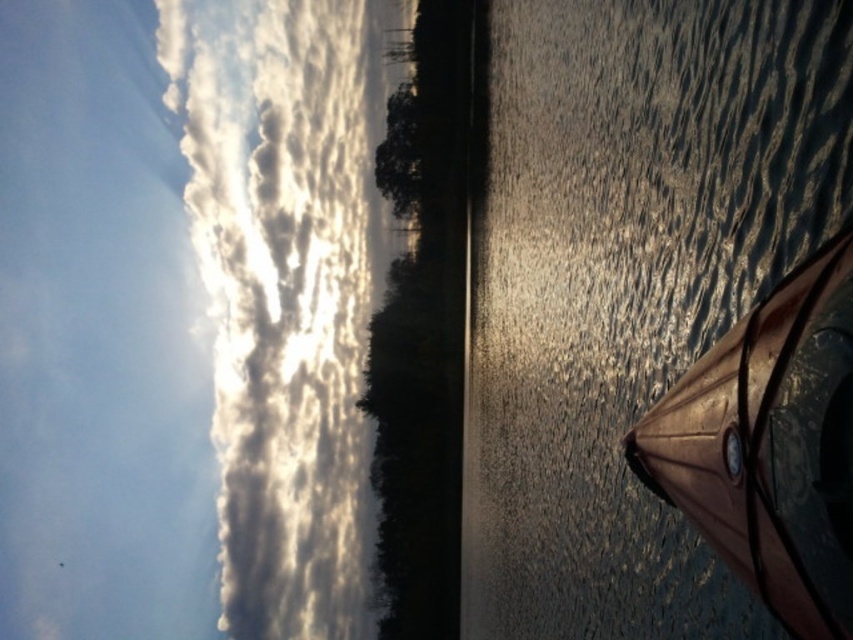
Question: Which point is farther to the camera?

Choices:
 (A) glistening water at lower right
 (B) cloudy sky at upper left

Answer: (B)

Question: Can you confirm if glistening water at lower right is bigger than cloudy sky at upper left?

Choices:
 (A) yes
 (B) no

Answer: (B)

Question: Among these objects, which one is nearest to the camera?

Choices:
 (A) cloudy sky at upper left
 (B) glistening water at lower right

Answer: (B)

Question: Can you confirm if glistening water at lower right is bigger than cloudy sky at upper left?

Choices:
 (A) no
 (B) yes

Answer: (A)

Question: In this image, where is glistening water at lower right located relative to cloudy sky at upper left?

Choices:
 (A) left
 (B) right

Answer: (B)

Question: Which object appears closest to the camera in this image?

Choices:
 (A) cloudy sky at upper left
 (B) glistening water at lower right

Answer: (B)